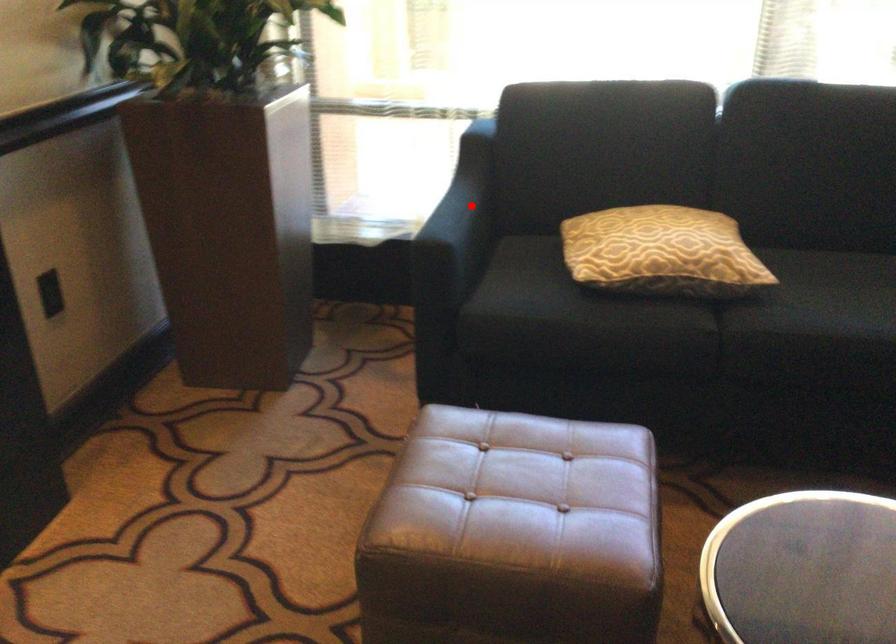
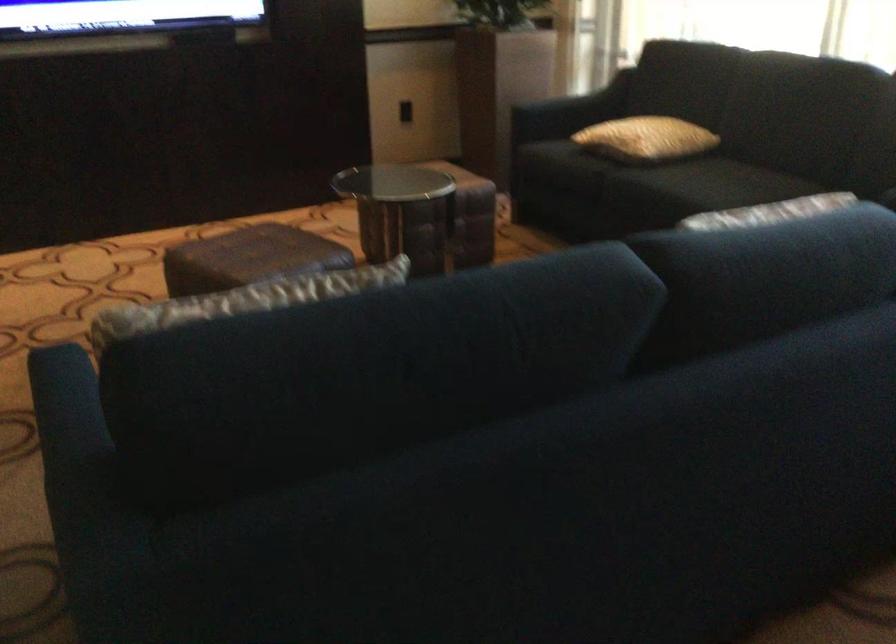
Question: I am providing you with two images of the same scene from different viewpoints. Given a red point in image1, look at the same physical point in image2. Is it:

Choices:
 (A) Closer to the viewpoint
 (B) Farther from the viewpoint

Answer: (B)